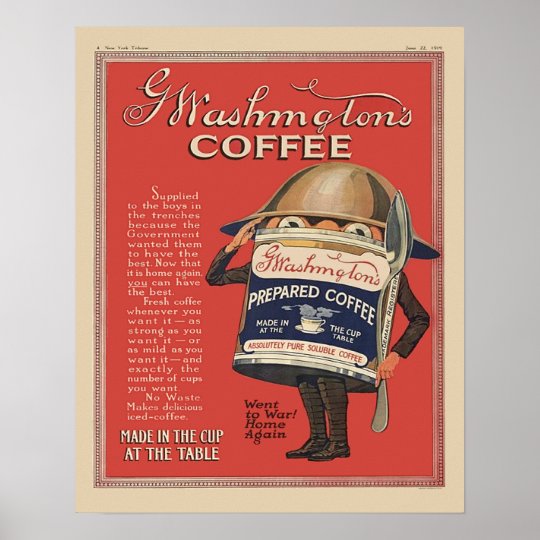
Where is `part of the spoon that you hold`? This screenshot has width=540, height=540. part of the spoon that you hold is located at coordinates (379, 346).